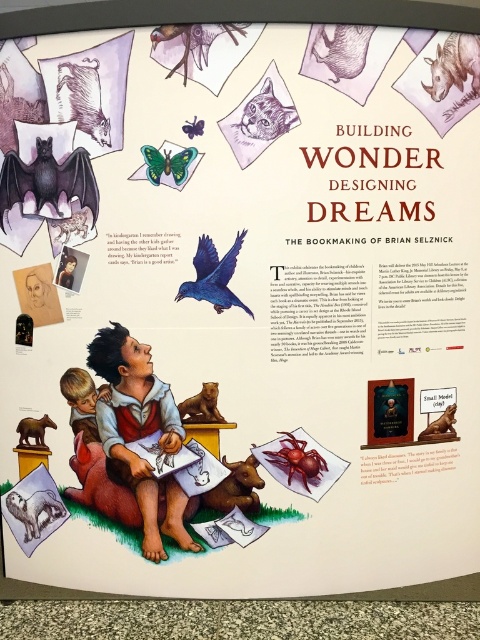
Question: Is matte gray cat at upper center smaller than green matte butterfly at upper center?

Choices:
 (A) no
 (B) yes

Answer: (A)

Question: Based on their relative distances, which object is farther from the brown furry dog at lower center?

Choices:
 (A) rubber-like spider at center
 (B) gray fur squirrel at upper center
 (C) blue glossy bird at upper center

Answer: (B)

Question: Which object is the farthest from the brown furry dog at lower center?

Choices:
 (A) brown textured fur at upper center
 (B) gray fur dog at lower left
 (C) shiny gold statue at center
 (D) smooth skin child at center

Answer: (A)

Question: Does rubber-like spider at center have a smaller size compared to matte green butterfly at upper center?

Choices:
 (A) no
 (B) yes

Answer: (A)

Question: Is rubber-like spider at center below green matte butterfly at upper center?

Choices:
 (A) no
 (B) yes

Answer: (B)

Question: Among these points, which one is nearest to the camera?

Choices:
 (A) (282, 115)
 (B) (51, 420)
 (C) (285, 452)
 (D) (183, 417)

Answer: (A)